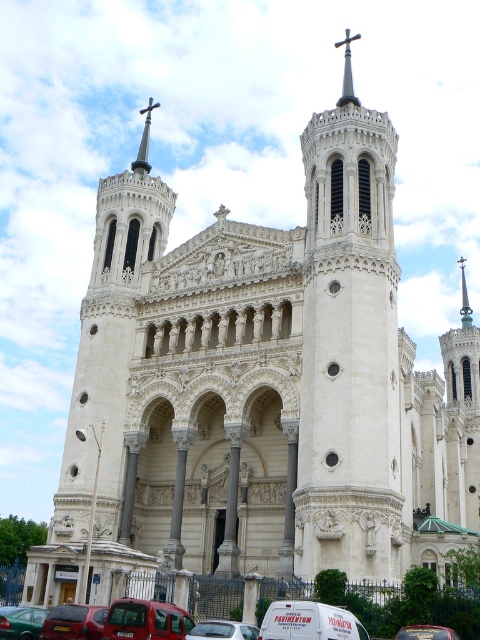
You are a tourist standing in front of the cathedral and want to take a photo of both the metallic red van at lower left and the metallic silver van at center. Based on their positions, which van should you frame first in your camera viewfinder to ensure both are captured in the photo?

The metallic red van at lower left should be framed first in your camera viewfinder since it is positioned to the left of the metallic silver van at center, ensuring both are included in the photo.

You are a delivery driver who needs to park your metallic red van at lower left and metallic silver van at center in a parking lot that can only accommodate one van at a time. Based on the image, which van should you park first to ensure both can fit?

The metallic red van at lower left is smaller than the metallic silver van at center, so you should park the metallic silver van at center first to leave enough space for the smaller metallic red van at lower left.

You are a pedestrian standing at the entrance of the cathedral. You see two vans, the metallic red van at lower left and the metallic silver van at center. Which van is closer to you?

The metallic red van at lower left is closer to you because the metallic silver van at center is behind it.